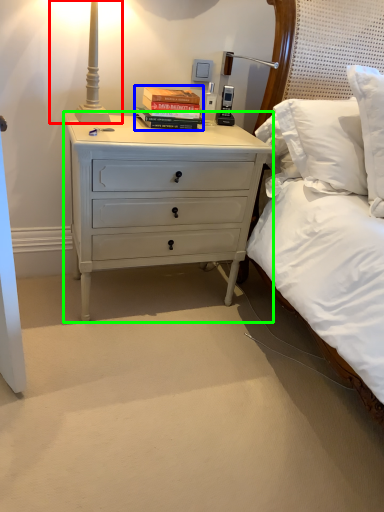
Question: Which is nearer to the bedside lamp (highlighted by a red box)? book (highlighted by a blue box) or nightstand (highlighted by a green box).

Choices:
 (A) book
 (B) nightstand

Answer: (A)